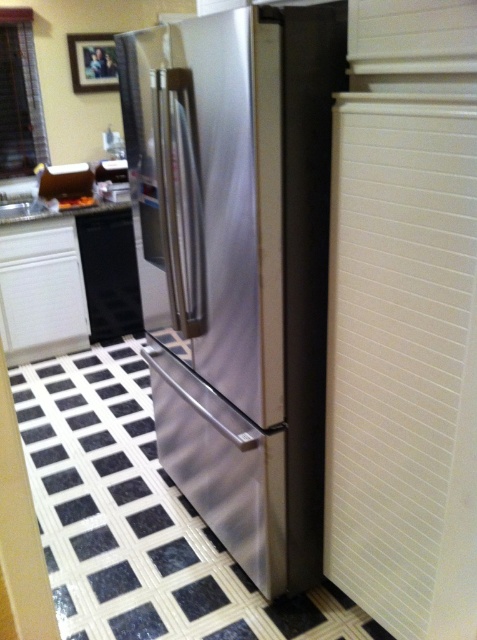
From the picture: You are moving a 1.5 meter wide box into the kitchen. You need to place it between the stainless steel refrigerator at center and the black matte dishwasher at lower left. Is there enough space?

The distance between the stainless steel refrigerator at center and the black matte dishwasher at lower left is 1.81 meters. Since the box is 1.5 meters wide, there is enough space to place it between them as the distance is greater than the box width.

You are trying to decide if the stainless steel refrigerator at center will fit through the doorway that the black matte dishwasher at lower left is currently occupying. Can you determine if it will fit based on their widths?

The stainless steel refrigerator at center might be wider than black matte dishwasher at lower left, so there is a possibility it may not fit through the doorway the dishwasher is occupying. Further measurements would be needed to confirm.